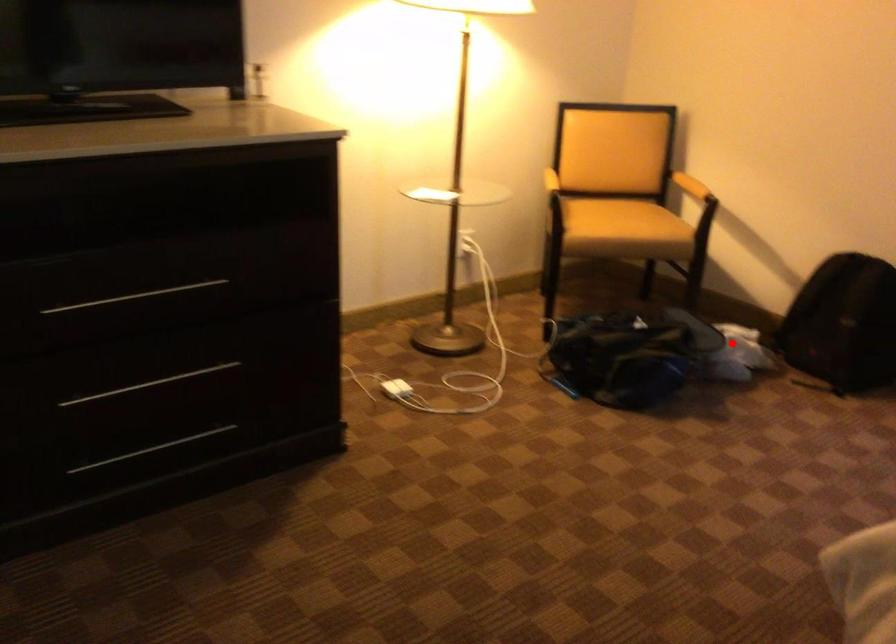
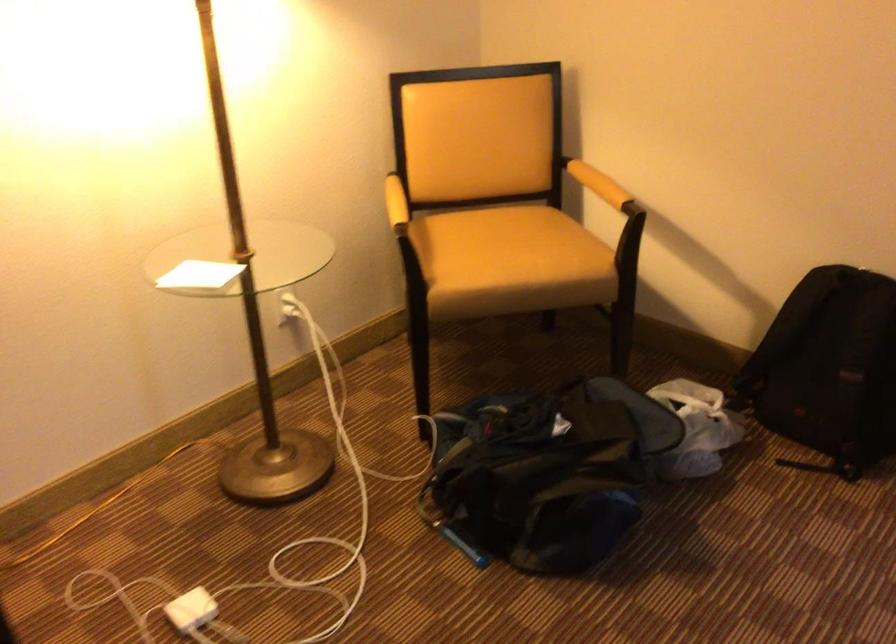
Question: A red point is marked in image1. In image2, is the corresponding 3D point closer to the camera or farther? Reply with the corresponding letter.

Choices:
 (A) The corresponding 3D point is closer.
 (B) The corresponding 3D point is farther.

Answer: (A)